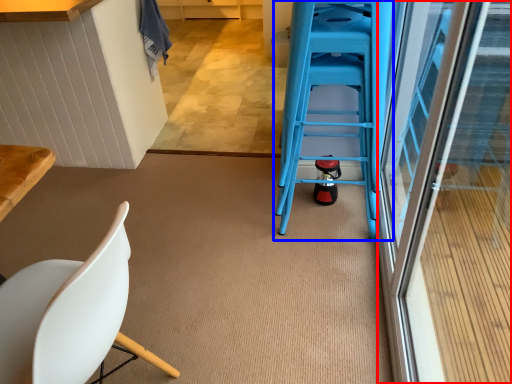
Question: Which point is closer to the camera, screen door (highlighted by a red box) or ladder (highlighted by a blue box)?

Choices:
 (A) screen door
 (B) ladder

Answer: (A)